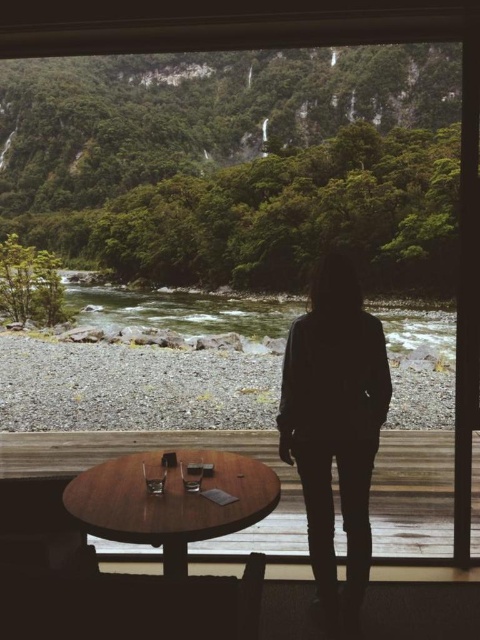
Can you confirm if wooden table at lower center is bigger than gray gravel river at center?

No, wooden table at lower center is not bigger than gray gravel river at center.

Can you confirm if wooden table at lower center is taller than gray gravel river at center?

No, wooden table at lower center is not taller than gray gravel river at center.

Is point (130, 513) positioned before point (395, 349)?

Yes, point (130, 513) is closer to viewer.

Where is `wooden table at lower center`? This screenshot has width=480, height=640. wooden table at lower center is located at coordinates (171, 499).

Does silhouette fabric at center have a smaller size compared to wooden table at lower center?

No.

Can you confirm if silhouette fabric at center is positioned above wooden table at lower center?

Yes, silhouette fabric at center is above wooden table at lower center.

Where is `silhouette fabric at center`? This screenshot has width=480, height=640. silhouette fabric at center is located at coordinates (335, 420).

Can you confirm if silhouette fabric at center is shorter than gray gravel river at center?

Correct, silhouette fabric at center is not as tall as gray gravel river at center.

Who is positioned more to the left, silhouette fabric at center or gray gravel river at center?

gray gravel river at center is more to the left.

Is point (379, 337) positioned before point (283, 333)?

Yes, it is in front of point (283, 333).

At what (x,y) coordinates should I click in order to perform the action: click on silhouette fabric at center. Please return your answer as a coordinate pair (x, y). Looking at the image, I should click on (335, 420).